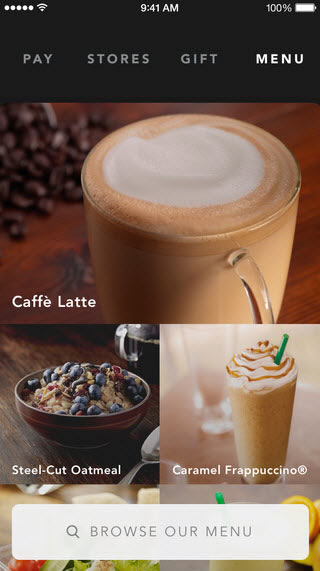
Where is `light brown foam on top of latte`? This screenshot has height=571, width=320. light brown foam on top of latte is located at coordinates (170, 223).